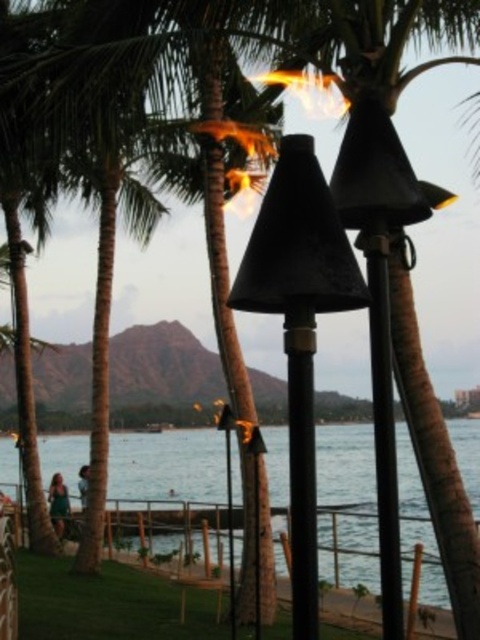
Question: Among these points, which one is farthest from the camera?

Choices:
 (A) (422, 582)
 (B) (330, 244)
 (C) (397, 529)
 (D) (302, 600)

Answer: (A)

Question: Does black matte tiki torch at center have a larger size compared to black metal pole at center?

Choices:
 (A) yes
 (B) no

Answer: (A)

Question: Which of these objects is positioned farthest from the black metal pole at center?

Choices:
 (A) black matte pole at center
 (B) clear blue water at lower center

Answer: (B)

Question: Which point is closer to the camera?

Choices:
 (A) (233, 497)
 (B) (312, 483)

Answer: (B)

Question: Can you confirm if clear blue water at lower center is positioned above black matte pole at center?

Choices:
 (A) yes
 (B) no

Answer: (B)

Question: Is black matte tiki torch at center below black matte pole at center?

Choices:
 (A) yes
 (B) no

Answer: (B)